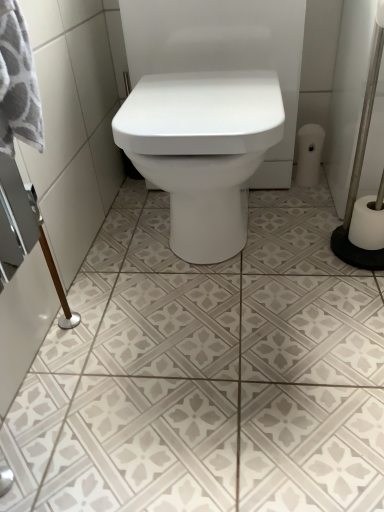
Question: From a real-world perspective, is white matte toilet paper at right, which is the second toilet paper from bottom to top, positioned under white textured tile at center based on gravity?

Choices:
 (A) no
 (B) yes

Answer: (A)

Question: Is white matte toilet paper at right, the second toilet paper positioned from the front, to the left of white textured tile at center from the viewer's perspective?

Choices:
 (A) no
 (B) yes

Answer: (A)

Question: From the image's perspective, is white matte toilet paper at right, the second toilet paper positioned from the front, on white textured tile at center?

Choices:
 (A) no
 (B) yes

Answer: (B)

Question: Is white matte toilet paper at right, which is counted as the 1th toilet paper, starting from the top, shorter than white textured tile at center?

Choices:
 (A) no
 (B) yes

Answer: (A)

Question: Does white matte toilet paper at right, which ranks as the 1th toilet paper in back-to-front order, have a greater height compared to white textured tile at center?

Choices:
 (A) yes
 (B) no

Answer: (A)

Question: Is white textured tile at center bigger or smaller than white matte toilet paper at right, marked as the second toilet paper in a right-to-left arrangement?

Choices:
 (A) small
 (B) big

Answer: (B)

Question: Considering the positions of white textured tile at center and white matte toilet paper at right, which is the second toilet paper from bottom to top, in the image, is white textured tile at center taller or shorter than white matte toilet paper at right, which is the second toilet paper from bottom to top,?

Choices:
 (A) short
 (B) tall

Answer: (A)

Question: From the image's perspective, relative to white matte toilet paper at right, which ranks as the 1th toilet paper in back-to-front order, is white textured tile at center above or below?

Choices:
 (A) above
 (B) below

Answer: (B)

Question: Considering the relative positions of white textured tile at center and white matte toilet paper at right, marked as the second toilet paper in a right-to-left arrangement, in the image provided, is white textured tile at center to the left or to the right of white matte toilet paper at right, marked as the second toilet paper in a right-to-left arrangement,?

Choices:
 (A) right
 (B) left

Answer: (B)

Question: Is point (374, 227) closer or farther from the camera than point (319, 130)?

Choices:
 (A) closer
 (B) farther

Answer: (A)

Question: Visually, is white matte toilet paper at right, the second toilet paper from the top, positioned to the left or to the right of white matte toilet paper at right, which is the second toilet paper from bottom to top?

Choices:
 (A) left
 (B) right

Answer: (B)

Question: In the image, is white matte toilet paper at right, which is the 1th toilet paper from front to back, positioned in front of or behind white matte toilet paper at right, the 1th toilet paper positioned from the left?

Choices:
 (A) behind
 (B) front

Answer: (B)

Question: In terms of height, does white matte toilet paper at right, which is the 1th toilet paper in bottom-to-top order, look taller or shorter compared to white matte toilet paper at right, which is the second toilet paper from bottom to top?

Choices:
 (A) short
 (B) tall

Answer: (A)

Question: Looking at their shapes, would you say white matte toilet paper at right, the 1th toilet paper positioned from the left, is wider or thinner than white textured tile at center?

Choices:
 (A) wide
 (B) thin

Answer: (B)

Question: In terms of height, does white matte toilet paper at right, which is the second toilet paper from bottom to top, look taller or shorter compared to white textured tile at center?

Choices:
 (A) short
 (B) tall

Answer: (B)